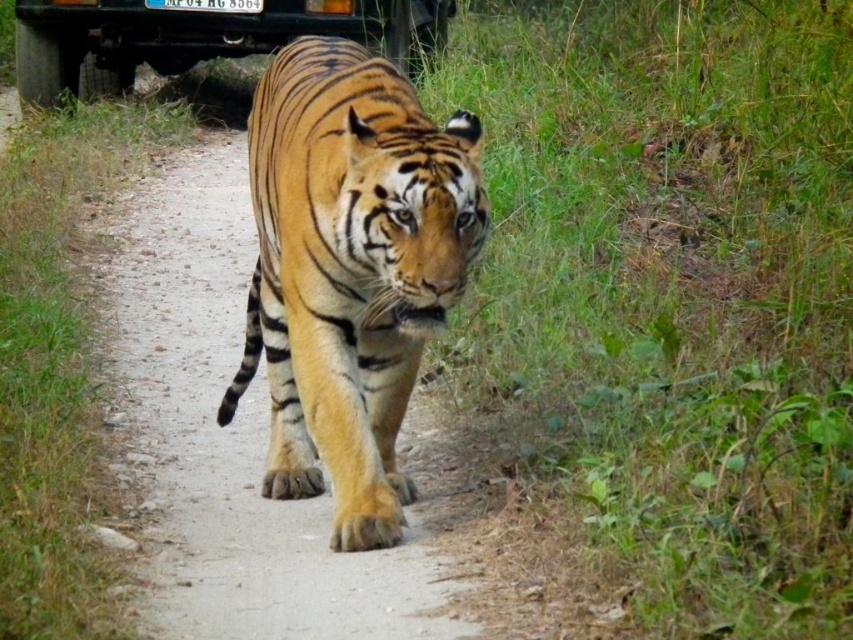
Question: Is orange-yellow fur tiger at center bigger than metallic black truck at upper center?

Choices:
 (A) no
 (B) yes

Answer: (A)

Question: Can you confirm if orange-yellow fur tiger at center is positioned to the left of metallic black truck at upper center?

Choices:
 (A) no
 (B) yes

Answer: (A)

Question: Is orange-yellow fur tiger at center positioned behind metallic black truck at upper center?

Choices:
 (A) yes
 (B) no

Answer: (B)